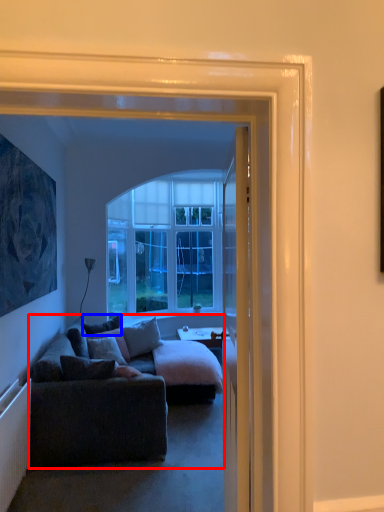
Question: Among these objects, which one is farthest to the camera, studio couch (highlighted by a red box) or pillow (highlighted by a blue box)?

Choices:
 (A) studio couch
 (B) pillow

Answer: (B)